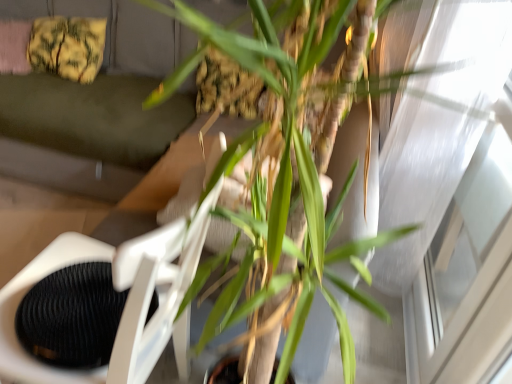
Question: Can you confirm if green leafy plant at center is bigger than green fabric couch at upper center?

Choices:
 (A) yes
 (B) no

Answer: (B)

Question: Does green leafy plant at center appear on the right side of green fabric couch at upper center?

Choices:
 (A) yes
 (B) no

Answer: (A)

Question: Can you see green leafy plant at center touching green fabric couch at upper center?

Choices:
 (A) yes
 (B) no

Answer: (B)

Question: Is the position of green leafy plant at center less distant than that of green fabric couch at upper center?

Choices:
 (A) yes
 (B) no

Answer: (A)

Question: Is green leafy plant at center not within green fabric couch at upper center?

Choices:
 (A) no
 (B) yes

Answer: (B)

Question: Is yellow fabric pillow at upper left wider or thinner than white plastic swivel chair at center?

Choices:
 (A) wide
 (B) thin

Answer: (B)

Question: In terms of size, does yellow fabric pillow at upper left appear bigger or smaller than white plastic swivel chair at center?

Choices:
 (A) big
 (B) small

Answer: (B)

Question: Considering their positions, is yellow fabric pillow at upper left located in front of or behind white plastic swivel chair at center?

Choices:
 (A) front
 (B) behind

Answer: (B)

Question: From a real-world perspective, is yellow fabric pillow at upper left positioned above or below white plastic swivel chair at center?

Choices:
 (A) above
 (B) below

Answer: (A)

Question: Considering the positions of green leafy plant at center and green fabric couch at upper center in the image, is green leafy plant at center wider or thinner than green fabric couch at upper center?

Choices:
 (A) wide
 (B) thin

Answer: (B)

Question: In the image, is green leafy plant at center on the left side or the right side of green fabric couch at upper center?

Choices:
 (A) right
 (B) left

Answer: (A)

Question: Is point (293, 177) closer or farther from the camera than point (140, 39)?

Choices:
 (A) closer
 (B) farther

Answer: (A)

Question: Do you think green leafy plant at center is within green fabric couch at upper center, or outside of it?

Choices:
 (A) outside
 (B) inside

Answer: (A)

Question: Relative to transparent glass window at upper right, is green fabric couch at upper center in front or behind?

Choices:
 (A) behind
 (B) front

Answer: (A)

Question: Does point (55, 107) appear closer or farther from the camera than point (473, 91)?

Choices:
 (A) farther
 (B) closer

Answer: (A)